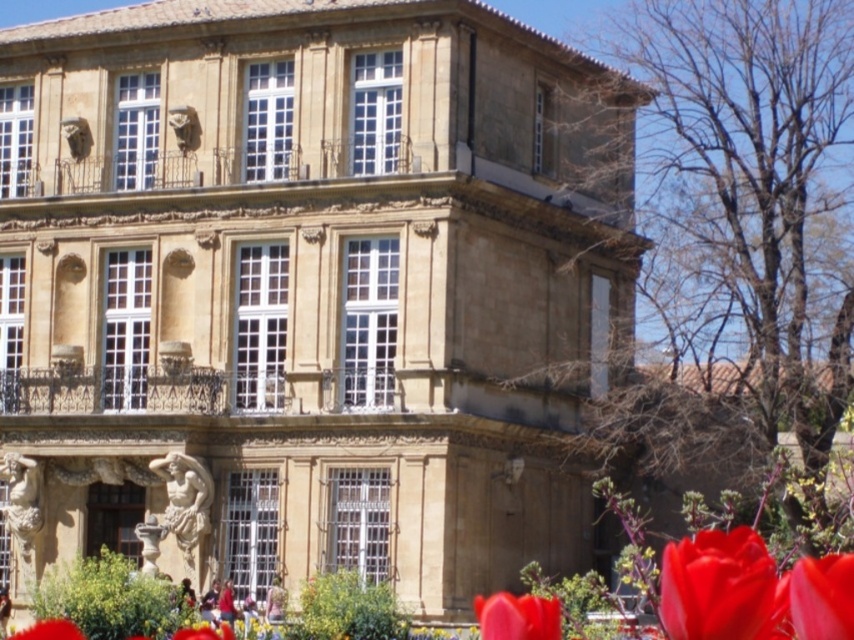
You are a gardener who wants to plant a new tulip in the garden. You have two options in the image, the glossy red tulip at lower right and the smooth red petal at lower left. Which one has a wider base?

The smooth red petal at lower left is wider than the glossy red tulip at lower right, so the smooth red petal at lower left has a wider base.

You are an architect analyzing the composition of the image. The building is the main subject, but you notice a vivid red petal at lower right. Where exactly is this petal located in the image? Please provide its coordinates as a point between 0 and 1 in both x and y axes.

The vivid red petal at lower right is located at coordinates approximately 0.933 on the x axis and 0.964 on the y axis.